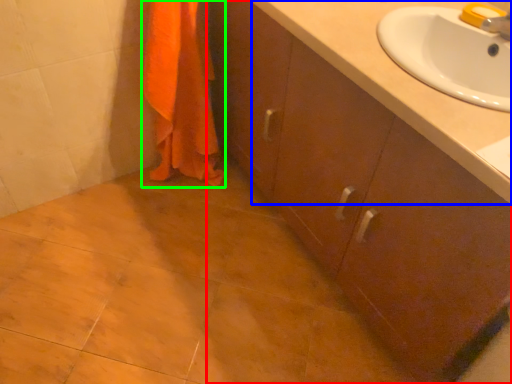
Question: Estimate the real-world distances between objects in this image. Which object is closer to bathroom cabinet (highlighted by a red box), counter top (highlighted by a blue box) or bath towel (highlighted by a green box)?

Choices:
 (A) counter top
 (B) bath towel

Answer: (A)